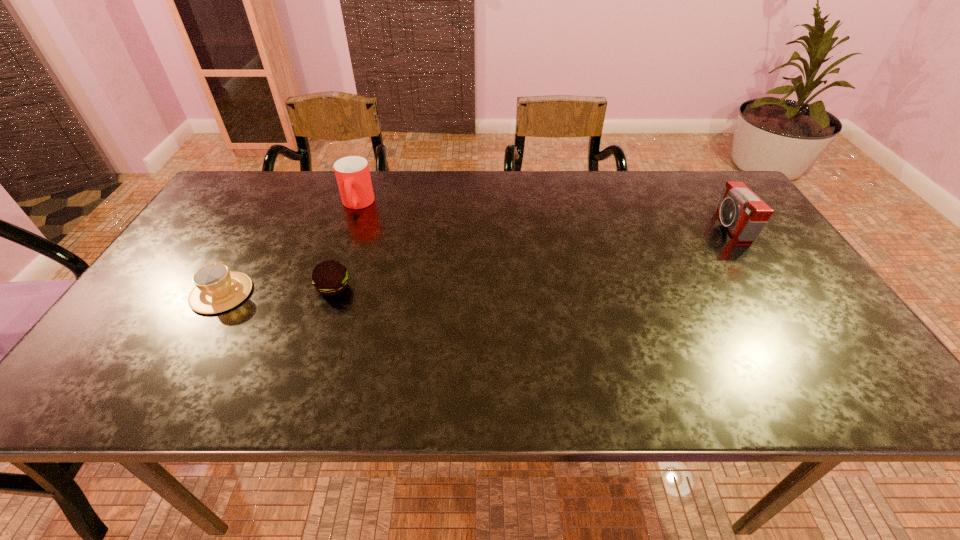
Where is `free point located on the right of the patty`? Image resolution: width=960 pixels, height=540 pixels. free point located on the right of the patty is located at coordinates (467, 288).

Where is `free region located 0.270m with the handle on the side of the nearer cup`? This screenshot has width=960, height=540. free region located 0.270m with the handle on the side of the nearer cup is located at coordinates (270, 210).

Find the location of a particular element. This screenshot has height=540, width=960. vacant space located 0.200m with the handle on the side of the nearer cup is located at coordinates (261, 225).

Find the location of a particular element. Image resolution: width=960 pixels, height=540 pixels. vacant area situated with the handle on the side of the nearer cup is located at coordinates (253, 238).

The height and width of the screenshot is (540, 960). In order to click on cup that is at the far edge in this screenshot , I will do `click(352, 173)`.

Where is `camera that is at the far edge`? camera that is at the far edge is located at coordinates (745, 215).

At what (x,y) coordinates should I click in order to perform the action: click on object present at the left edge. Please return your answer as a coordinate pair (x, y). Looking at the image, I should click on (217, 290).

The height and width of the screenshot is (540, 960). Find the location of `object that is positioned at the right edge`. object that is positioned at the right edge is located at coordinates (745, 215).

Locate an element on the screen. object at the far right corner is located at coordinates (745, 215).

Locate an element on the screen. free space at the far edge is located at coordinates (424, 186).